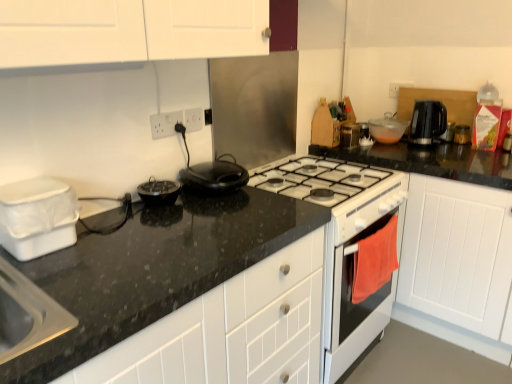
At what (x,y) coordinates should I click in order to perform the action: click on vacant area that is in front of metallic silver spice rack at upper right, which ranks as the 5th kitchen appliance in front-to-back order. Please return your answer as a coordinate pair (x, y). Looking at the image, I should click on (375, 151).